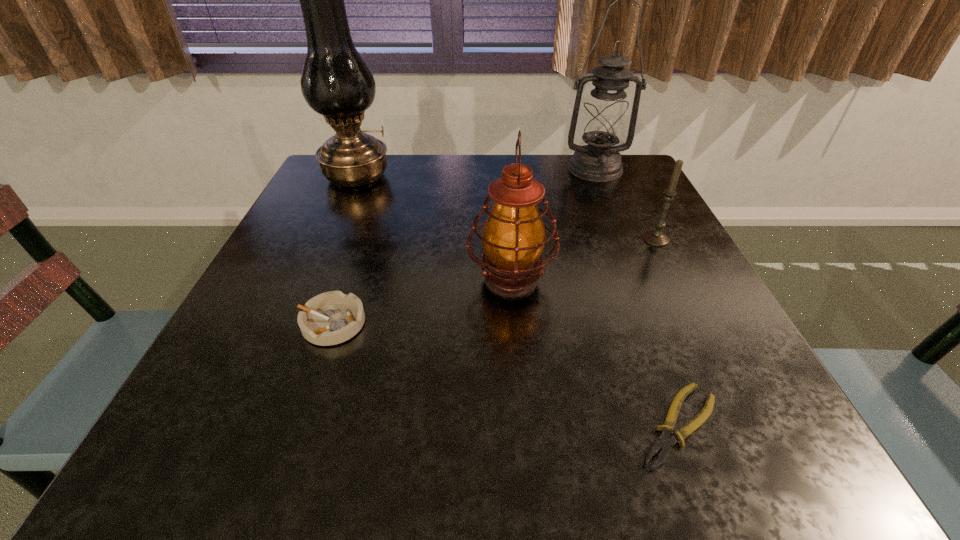
The height and width of the screenshot is (540, 960). What are the coordinates of `vacant space located on the left of the rightmost oil lamp` in the screenshot? It's located at (440, 169).

Where is `free space located on the left of the second oil lamp from left to right`? free space located on the left of the second oil lamp from left to right is located at coordinates (327, 279).

In order to click on vacant space located on the front of the fourth tallest object in this screenshot , I will do click(741, 406).

Image resolution: width=960 pixels, height=540 pixels. Find the location of `free space located 0.360m on the back of the ashtray`. free space located 0.360m on the back of the ashtray is located at coordinates (375, 196).

The image size is (960, 540). I want to click on vacant region located on the back of the shortest object, so click(x=624, y=278).

Locate an element on the screen. The height and width of the screenshot is (540, 960). object that is positioned at the near edge is located at coordinates (664, 443).

You are a GUI agent. You are given a task and a screenshot of the screen. Output one action in this format:
    pyautogui.click(x=<x>, y=<y>)
    Task: Click on the oil lamp present at the left edge
    The height and width of the screenshot is (540, 960).
    Given the screenshot: What is the action you would take?
    pyautogui.click(x=336, y=82)

Locate an element on the screen. This screenshot has width=960, height=540. ashtray that is at the left edge is located at coordinates click(330, 318).

What are the coordinates of `oil lamp that is at the right edge` in the screenshot? It's located at (604, 118).

Locate an element on the screen. The width and height of the screenshot is (960, 540). candle at the right edge is located at coordinates (656, 237).